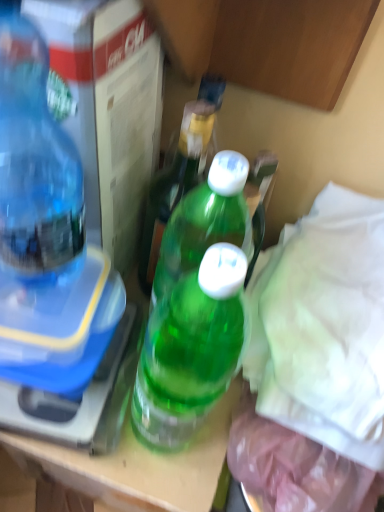
Find the location of a particular element. green plastic bottle at center, which appears as the 1th bottle when viewed from the right is located at coordinates (175, 182).

Describe the element at coordinates (175, 182) in the screenshot. I see `green plastic bottle at center, which is counted as the 2th bottle, starting from the left` at that location.

Find the location of a particular element. This screenshot has width=384, height=512. transparent plastic bottle at left, placed as the 2th bottle when sorted from right to left is located at coordinates (35, 166).

What do you see at coordinates (35, 166) in the screenshot? I see `transparent plastic bottle at left, marked as the 1th bottle in a left-to-right arrangement` at bounding box center [35, 166].

I want to click on green plastic bottle at center, which is counted as the 2th bottle, starting from the left, so click(175, 182).

Is transparent plastic bottle at left, marked as the 1th bottle in a left-to-right arrangement, at the right side of green plastic bottle at center, which appears as the 1th bottle when viewed from the right?

No, transparent plastic bottle at left, marked as the 1th bottle in a left-to-right arrangement, is not to the right of green plastic bottle at center, which appears as the 1th bottle when viewed from the right.

Does transparent plastic bottle at left, marked as the 1th bottle in a left-to-right arrangement, lie behind green plastic bottle at center, which appears as the 1th bottle when viewed from the right?

No, transparent plastic bottle at left, marked as the 1th bottle in a left-to-right arrangement, is closer to the camera.

Is point (13, 242) in front of point (203, 123)?

Yes, point (13, 242) is in front of point (203, 123).

From the image's perspective, is transparent plastic bottle at left, marked as the 1th bottle in a left-to-right arrangement, beneath green plastic bottle at center, which appears as the 1th bottle when viewed from the right?

Actually, transparent plastic bottle at left, marked as the 1th bottle in a left-to-right arrangement, appears above green plastic bottle at center, which appears as the 1th bottle when viewed from the right, in the image.

From a real-world perspective, who is located higher, transparent plastic bottle at left, placed as the 2th bottle when sorted from right to left, or green plastic bottle at center, which is counted as the 2th bottle, starting from the left?

transparent plastic bottle at left, placed as the 2th bottle when sorted from right to left, from a real-world perspective.

Can you confirm if transparent plastic bottle at left, marked as the 1th bottle in a left-to-right arrangement, is wider than green plastic bottle at center, which is counted as the 2th bottle, starting from the left?

Yes.

Is transparent plastic bottle at left, placed as the 2th bottle when sorted from right to left, taller than green plastic bottle at center, which is counted as the 2th bottle, starting from the left?

Yes, transparent plastic bottle at left, placed as the 2th bottle when sorted from right to left, is taller than green plastic bottle at center, which is counted as the 2th bottle, starting from the left.

Does transparent plastic bottle at left, marked as the 1th bottle in a left-to-right arrangement, have a smaller size compared to green plastic bottle at center, which is counted as the 2th bottle, starting from the left?

No.

Looking at this image, is green plastic bottle at center, which is counted as the 2th bottle, starting from the left, inside transparent plastic bottle at left, marked as the 1th bottle in a left-to-right arrangement?

No, green plastic bottle at center, which is counted as the 2th bottle, starting from the left, is located outside of transparent plastic bottle at left, marked as the 1th bottle in a left-to-right arrangement.

Is transparent plastic bottle at left, placed as the 2th bottle when sorted from right to left, directly adjacent to green plastic bottle at center, which appears as the 1th bottle when viewed from the right?

No, transparent plastic bottle at left, placed as the 2th bottle when sorted from right to left, is not beside green plastic bottle at center, which appears as the 1th bottle when viewed from the right.

Is green plastic bottle at center, which is counted as the 2th bottle, starting from the left, at the back of transparent plastic bottle at left, placed as the 2th bottle when sorted from right to left?

That's not correct — transparent plastic bottle at left, placed as the 2th bottle when sorted from right to left, is not looking away from green plastic bottle at center, which is counted as the 2th bottle, starting from the left.

Image resolution: width=384 pixels, height=512 pixels. What are the coordinates of `bottle in front of the green plastic bottle at center, which is counted as the 2th bottle, starting from the left` in the screenshot? It's located at (35, 166).

Is green plastic bottle at center, which is counted as the 2th bottle, starting from the left, to the left of transparent plastic bottle at left, marked as the 1th bottle in a left-to-right arrangement, from the viewer's perspective?

In fact, green plastic bottle at center, which is counted as the 2th bottle, starting from the left, is to the right of transparent plastic bottle at left, marked as the 1th bottle in a left-to-right arrangement.

Considering their positions, is green plastic bottle at center, which is counted as the 2th bottle, starting from the left, located in front of or behind transparent plastic bottle at left, marked as the 1th bottle in a left-to-right arrangement?

Visually, green plastic bottle at center, which is counted as the 2th bottle, starting from the left, is located behind transparent plastic bottle at left, marked as the 1th bottle in a left-to-right arrangement.

Considering the positions of points (170, 182) and (10, 256), is point (170, 182) farther from camera compared to point (10, 256)?

Yes.

From the picture: From the image's perspective, which is above, green plastic bottle at center, which is counted as the 2th bottle, starting from the left, or transparent plastic bottle at left, marked as the 1th bottle in a left-to-right arrangement?

transparent plastic bottle at left, marked as the 1th bottle in a left-to-right arrangement.

From a real-world perspective, is green plastic bottle at center, which is counted as the 2th bottle, starting from the left, beneath transparent plastic bottle at left, marked as the 1th bottle in a left-to-right arrangement?

Yes, from a real-world perspective, green plastic bottle at center, which is counted as the 2th bottle, starting from the left, is below transparent plastic bottle at left, marked as the 1th bottle in a left-to-right arrangement.

Is green plastic bottle at center, which appears as the 1th bottle when viewed from the right, wider or thinner than transparent plastic bottle at left, placed as the 2th bottle when sorted from right to left?

Clearly, green plastic bottle at center, which appears as the 1th bottle when viewed from the right, has less width compared to transparent plastic bottle at left, placed as the 2th bottle when sorted from right to left.

Considering the relative sizes of green plastic bottle at center, which appears as the 1th bottle when viewed from the right, and transparent plastic bottle at left, marked as the 1th bottle in a left-to-right arrangement, in the image provided, is green plastic bottle at center, which appears as the 1th bottle when viewed from the right, taller than transparent plastic bottle at left, marked as the 1th bottle in a left-to-right arrangement,?

In fact, green plastic bottle at center, which appears as the 1th bottle when viewed from the right, may be shorter than transparent plastic bottle at left, marked as the 1th bottle in a left-to-right arrangement.

Who is smaller, green plastic bottle at center, which is counted as the 2th bottle, starting from the left, or transparent plastic bottle at left, placed as the 2th bottle when sorted from right to left?

With smaller size is green plastic bottle at center, which is counted as the 2th bottle, starting from the left.

Is transparent plastic bottle at left, marked as the 1th bottle in a left-to-right arrangement, inside green plastic bottle at center, which appears as the 1th bottle when viewed from the right?

No, transparent plastic bottle at left, marked as the 1th bottle in a left-to-right arrangement, is not inside green plastic bottle at center, which appears as the 1th bottle when viewed from the right.

Does green plastic bottle at center, which appears as the 1th bottle when viewed from the right, touch transparent plastic bottle at left, marked as the 1th bottle in a left-to-right arrangement?

No, green plastic bottle at center, which appears as the 1th bottle when viewed from the right, is not next to transparent plastic bottle at left, marked as the 1th bottle in a left-to-right arrangement.

Is green plastic bottle at center, which is counted as the 2th bottle, starting from the left, looking in the opposite direction of transparent plastic bottle at left, marked as the 1th bottle in a left-to-right arrangement?

No.

Measure the distance between green plastic bottle at center, which appears as the 1th bottle when viewed from the right, and transparent plastic bottle at left, marked as the 1th bottle in a left-to-right arrangement.

A distance of 5.89 inches exists between green plastic bottle at center, which appears as the 1th bottle when viewed from the right, and transparent plastic bottle at left, marked as the 1th bottle in a left-to-right arrangement.

You are a GUI agent. You are given a task and a screenshot of the screen. Output one action in this format:
    pyautogui.click(x=<x>, y=<y>)
    Task: Click on the bottle above the green plastic bottle at center, which is counted as the 2th bottle, starting from the left (from the image's perspective)
    
    Given the screenshot: What is the action you would take?
    pyautogui.click(x=35, y=166)

Find the location of a particular element. bottle that appears above the green plastic bottle at center, which appears as the 1th bottle when viewed from the right (from the image's perspective) is located at coordinates (35, 166).

What are the coordinates of `bottle behind the transparent plastic bottle at left, placed as the 2th bottle when sorted from right to left` in the screenshot? It's located at (175, 182).